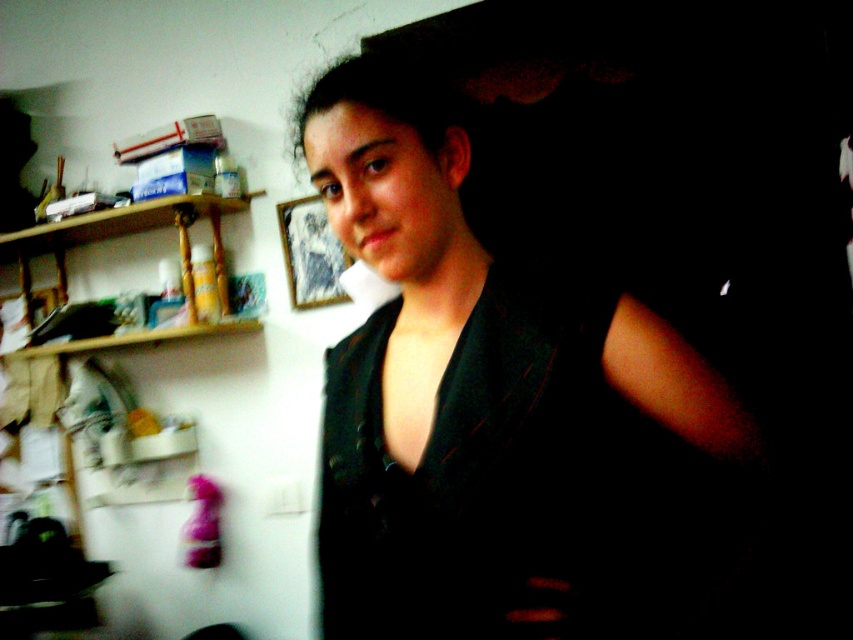
Is black matte dress at center positioned behind woodenmaterial/texturebookshelf at left?

No, black matte dress at center is in front of woodenmaterial/texturebookshelf at left.

Is black matte dress at center smaller than woodenmaterial/texturebookshelf at left?

No, black matte dress at center is not smaller than woodenmaterial/texturebookshelf at left.

Identify the location of black matte dress at center. This screenshot has height=640, width=853. (496, 410).

Between point (317, 544) and point (85, 218), which one is positioned behind?

Positioned behind is point (85, 218).

Does point (490, 560) come behind point (102, 218)?

No, it is in front of (102, 218).

Does point (432, 608) lie in front of point (105, 221)?

Yes, it is in front of point (105, 221).

At what (x,y) coordinates should I click in order to perform the action: click on black satin dress at center. Please return your answer as a coordinate pair (x, y). This screenshot has width=853, height=640. Looking at the image, I should click on (473, 474).

How far apart are black matte dress at center and black satin dress at center?

black matte dress at center and black satin dress at center are 3.10 inches apart.

Is black matte dress at center closer to the viewer compared to black satin dress at center?

Yes, it is.

Between point (677, 442) and point (486, 401), which one is positioned behind?

Point (677, 442)

Locate an element on the screen. This screenshot has width=853, height=640. black matte dress at center is located at coordinates (496, 410).